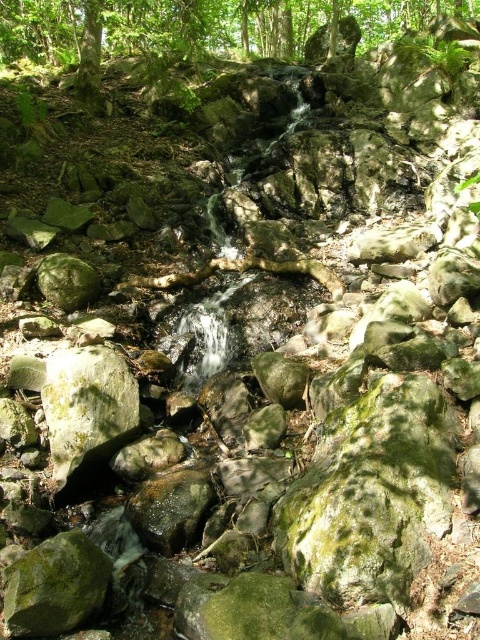
Can you confirm if green leafy tree at upper center is shorter than green mossy rock at center?

No, green leafy tree at upper center is not shorter than green mossy rock at center.

Does green leafy tree at upper center have a greater height compared to green mossy rock at center?

Correct, green leafy tree at upper center is much taller as green mossy rock at center.

Is point (308, 12) behind point (96, 410)?

Yes, point (308, 12) is behind point (96, 410).

Find the location of `green leafy tree at upper center`. green leafy tree at upper center is located at coordinates (203, 24).